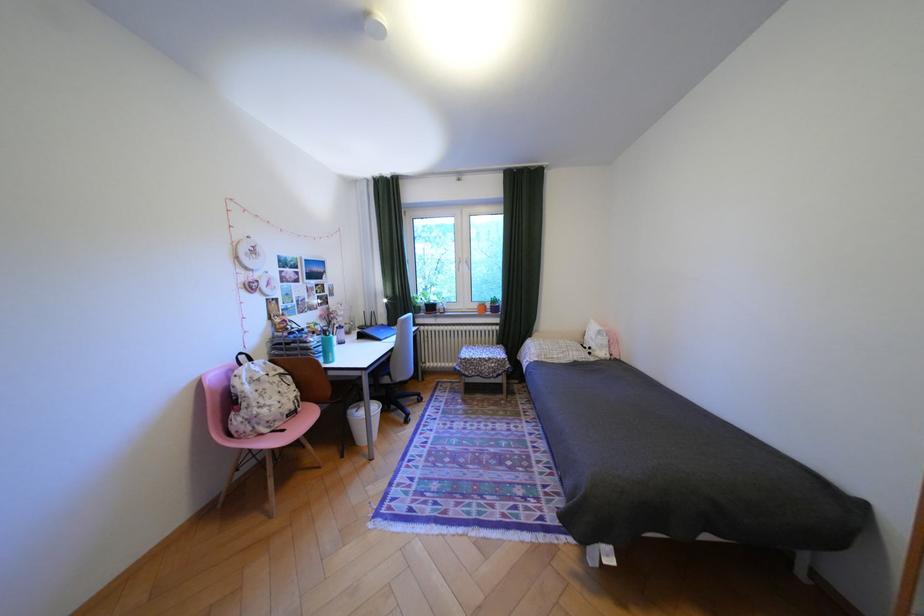
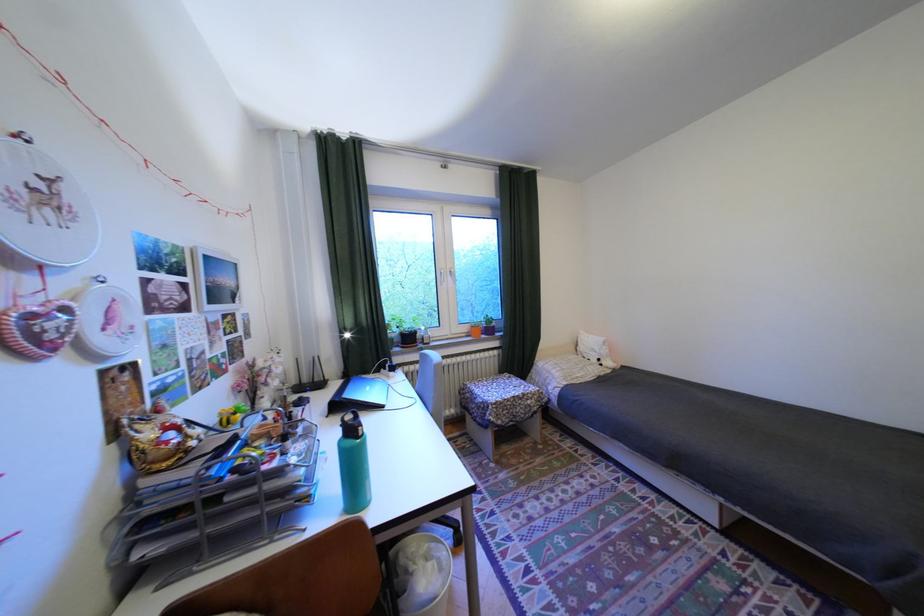
Where in the second image is the point corresponding to the point at 479,373 from the first image?

(512, 422)